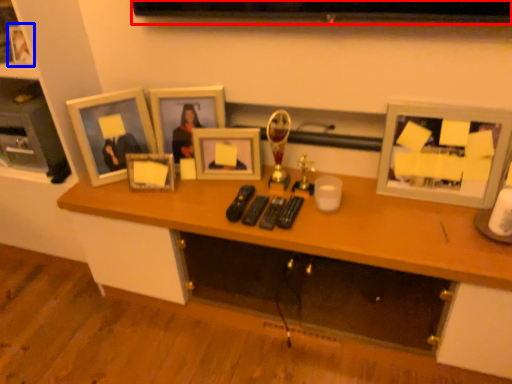
Question: Which object is further to the camera taking this photo, television (highlighted by a red box) or picture frame (highlighted by a blue box)?

Choices:
 (A) television
 (B) picture frame

Answer: (B)